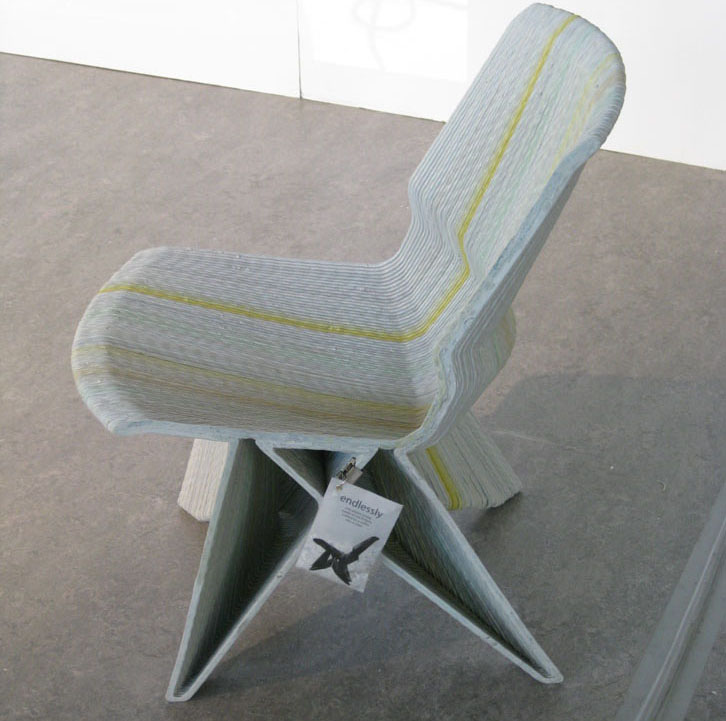
You are a GUI agent. You are given a task and a screenshot of the screen. Output one action in this format:
    pyautogui.click(x=<x>, y=<y>)
    Task: Click on the white wall
    
    Given the screenshot: What is the action you would take?
    pyautogui.click(x=362, y=78)